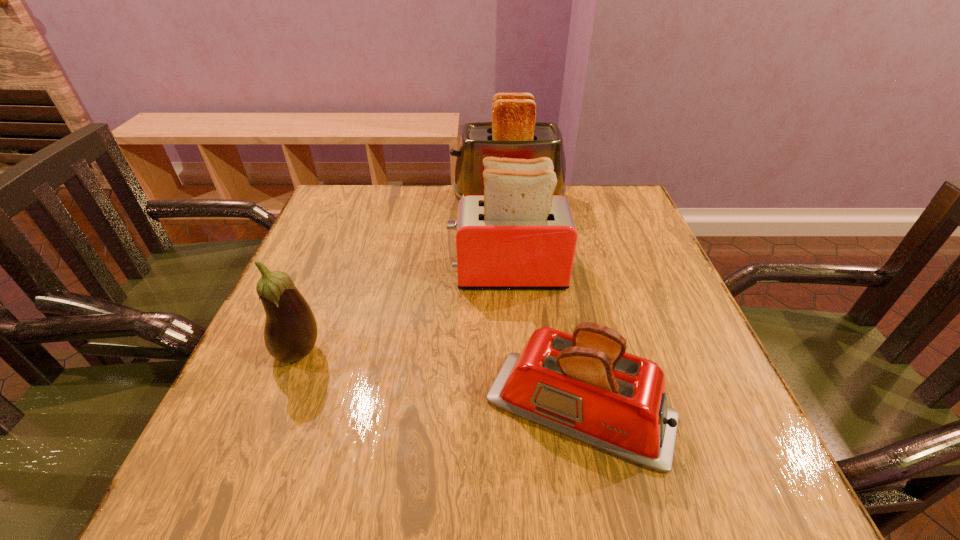
The height and width of the screenshot is (540, 960). In order to click on the farthest object in this screenshot , I will do `click(513, 133)`.

I want to click on the third nearest object, so click(518, 235).

You are a GUI agent. You are given a task and a screenshot of the screen. Output one action in this format:
    pyautogui.click(x=<x>, y=<y>)
    Task: Click on the second shortest object
    
    Given the screenshot: What is the action you would take?
    pyautogui.click(x=290, y=333)

In order to click on eggplant in this screenshot , I will do `click(290, 333)`.

The height and width of the screenshot is (540, 960). What are the coordinates of `the nearest toaster` in the screenshot? It's located at 586,386.

What are the coordinates of `the shortest toaster` in the screenshot? It's located at (586, 386).

At what (x,y) coordinates should I click in order to perform the action: click on vacant space located on the side of the farthest object with the control lever. Please return your answer as a coordinate pair (x, y). Looking at the image, I should click on (371, 201).

Where is `vacant space situated 0.050m on the side of the farthest object with the control lever`? Image resolution: width=960 pixels, height=540 pixels. vacant space situated 0.050m on the side of the farthest object with the control lever is located at coordinates [x=434, y=201].

Image resolution: width=960 pixels, height=540 pixels. I want to click on free space located on the side of the farthest object with the control lever, so click(374, 201).

Locate an element on the screen. The height and width of the screenshot is (540, 960). blank space located 0.210m on the front-facing side of the second farthest object is located at coordinates (358, 272).